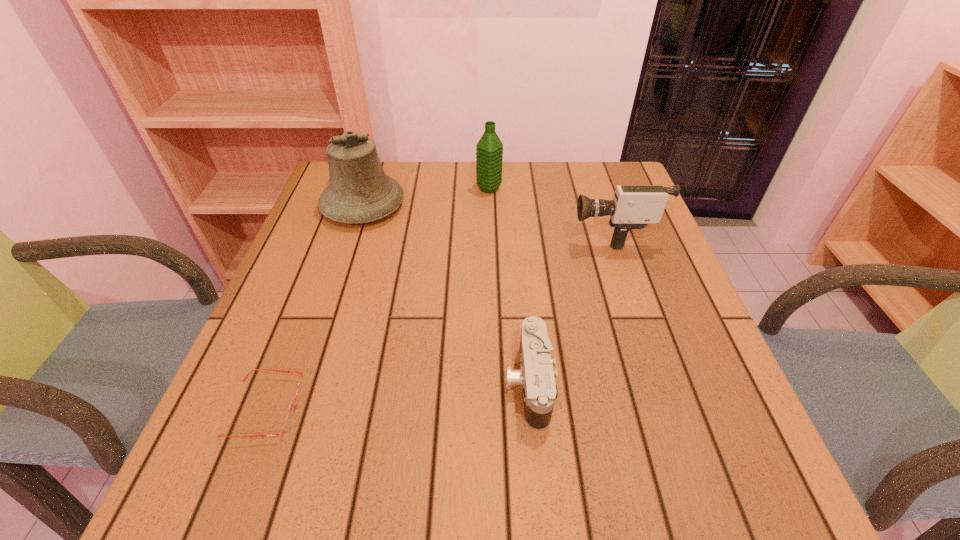
Image resolution: width=960 pixels, height=540 pixels. Find the location of `vacant space located on the recording direction of the camcorder`. vacant space located on the recording direction of the camcorder is located at coordinates (506, 234).

This screenshot has width=960, height=540. I want to click on vacant space located 0.360m on the lens of the fourth tallest object, so click(306, 382).

You are a GUI agent. You are given a task and a screenshot of the screen. Output one action in this format:
    pyautogui.click(x=<x>, y=<y>)
    Task: Click on the vacant space situated 0.080m on the lens of the fourth tallest object
    The height and width of the screenshot is (540, 960).
    Given the screenshot: What is the action you would take?
    pyautogui.click(x=462, y=382)

The height and width of the screenshot is (540, 960). I want to click on vacant space located on the lens of the fourth tallest object, so click(x=450, y=382).

The image size is (960, 540). Identify the location of blank space located 0.380m on the lenses of the spectacles. (520, 408).

The height and width of the screenshot is (540, 960). Find the location of `bell that is at the far edge`. bell that is at the far edge is located at coordinates (359, 191).

The height and width of the screenshot is (540, 960). What are the coordinates of `water bottle situated at the far edge` in the screenshot? It's located at [489, 149].

Locate an element on the screen. The width and height of the screenshot is (960, 540). bell present at the left edge is located at coordinates (359, 191).

Locate an element on the screen. The width and height of the screenshot is (960, 540). spectacles present at the left edge is located at coordinates (x=290, y=415).

At what (x,y) coordinates should I click in order to perform the action: click on object present at the right edge. Please return your answer as a coordinate pair (x, y). This screenshot has width=960, height=540. Looking at the image, I should click on (634, 206).